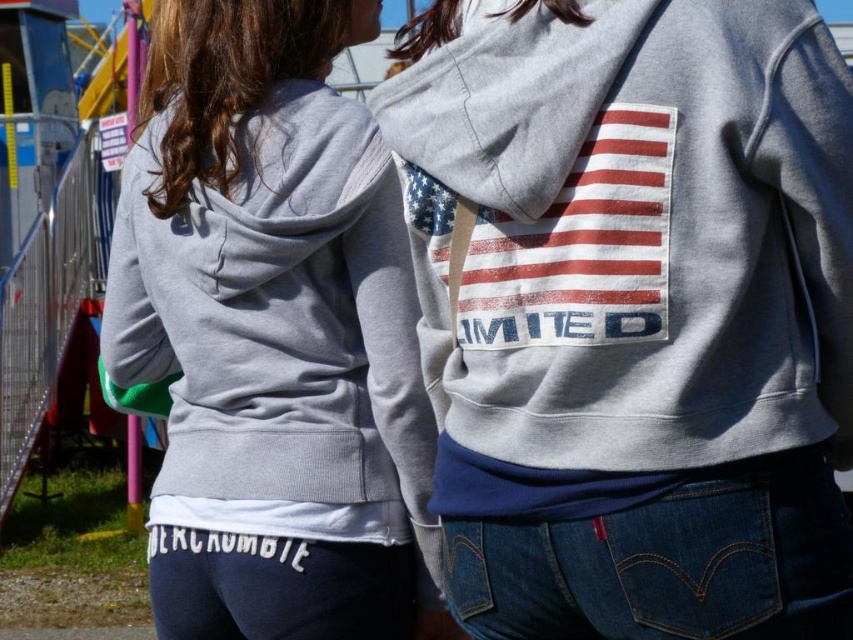
Between gray heathered hoodie at center and distressed white flag at center, which one appears on the left side from the viewer's perspective?

distressed white flag at center

Does gray heathered hoodie at center appear on the left side of distressed white flag at center?

Incorrect, gray heathered hoodie at center is not on the left side of distressed white flag at center.

Between point (733, 200) and point (666, 220), which one is positioned behind?

Point (666, 220)

In order to click on gray heathered hoodie at center in this screenshot , I will do `click(630, 230)`.

In the scene shown: Which is below, matte gray hoodie at center or distressed white flag at center?

Positioned lower is matte gray hoodie at center.

Consider the image. Is matte gray hoodie at center thinner than distressed white flag at center?

No, matte gray hoodie at center is not thinner than distressed white flag at center.

Is point (242, 371) farther from camera compared to point (526, 250)?

Yes, it is behind point (526, 250).

This screenshot has width=853, height=640. What are the coordinates of `matte gray hoodie at center` in the screenshot? It's located at (270, 330).

What do you see at coordinates (630, 230) in the screenshot? The width and height of the screenshot is (853, 640). I see `gray heathered hoodie at center` at bounding box center [630, 230].

The width and height of the screenshot is (853, 640). I want to click on gray heathered hoodie at center, so click(x=630, y=230).